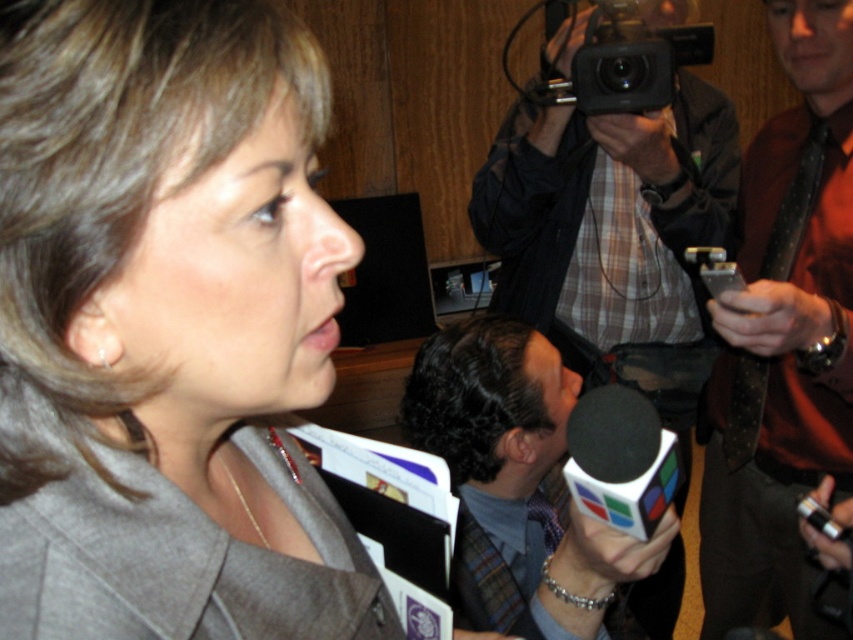
From the picture: You are attending a virtual conference and need to identify the tallest object between the plaid shirt at upper center and the plaid fabric tie at center. Which one is taller?

The plaid shirt at upper center is much taller than the plaid fabric tie at center.

You are attending a press conference and notice two items with plaid patterns. The plaid shirt at upper center and the plaid fabric tie at center. Which one is closer to you?

The plaid shirt at upper center is closer to you because it is further to the viewer than the plaid fabric tie at center.